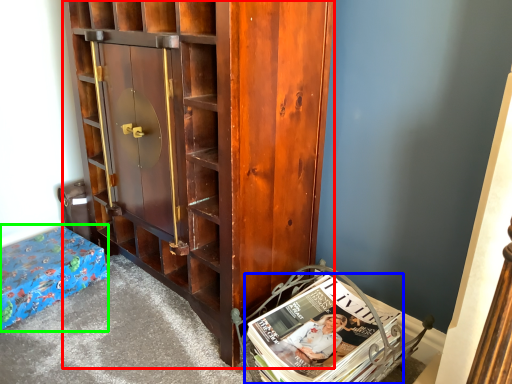
Question: Which object is the farthest from cabinetry (highlighted by a red box)? Choose among these: book (highlighted by a blue box) or furniture (highlighted by a green box).

Choices:
 (A) book
 (B) furniture

Answer: (B)